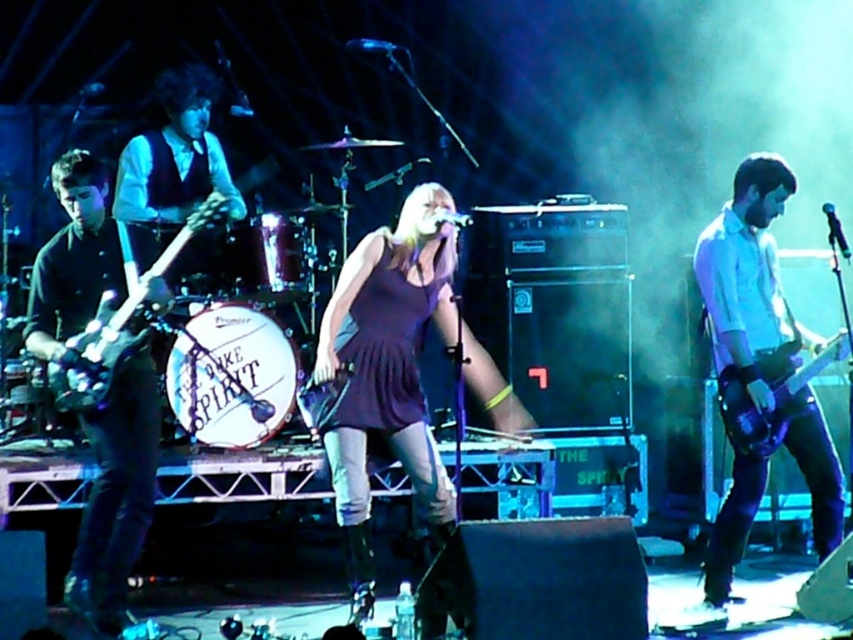
Does purple satin dress at center lie in front of matte white shirt at right?

Yes, purple satin dress at center is closer to the viewer.

Does point (370, 586) lie behind point (740, 525)?

No, it is not.

Locate an element on the screen. purple satin dress at center is located at coordinates (387, 372).

In the scene shown: Is matte white shirt at right smaller than shiny black electric guitar at left?

Incorrect, matte white shirt at right is not smaller in size than shiny black electric guitar at left.

Can you confirm if matte white shirt at right is positioned below shiny black electric guitar at left?

Correct, matte white shirt at right is located below shiny black electric guitar at left.

Who is more distant from viewer, [780,209] or [74,404]?

The point [780,209] is behind.

This screenshot has width=853, height=640. I want to click on matte white shirt at right, so click(749, 280).

Between purple satin dress at center and shiny purple electric guitar at right, which one has more height?

purple satin dress at center is taller.

Which is below, purple satin dress at center or shiny purple electric guitar at right?

Positioned lower is purple satin dress at center.

Between point (370, 266) and point (743, 412), which one is positioned in front?

Point (370, 266)

The height and width of the screenshot is (640, 853). I want to click on purple satin dress at center, so click(387, 372).